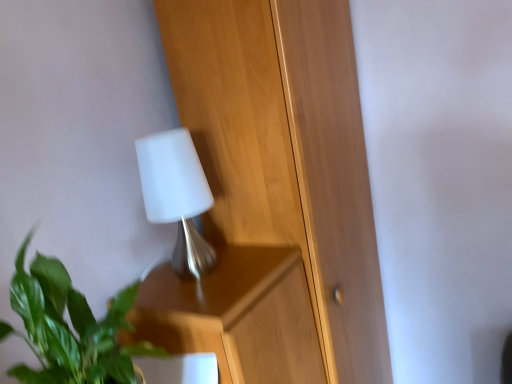
Measure the distance between green leafy plant at lower left and camera.

green leafy plant at lower left and camera are 21.06 inches apart from each other.

This screenshot has width=512, height=384. What do you see at coordinates (177, 196) in the screenshot?
I see `white matte lamp at upper center` at bounding box center [177, 196].

The width and height of the screenshot is (512, 384). I want to click on green leafy plant at lower left, so click(x=69, y=328).

From a real-world perspective, relative to green leafy plant at lower left, is wooden dresser at center vertically above or below?

wooden dresser at center is below green leafy plant at lower left.

From the image's perspective, between wooden dresser at center and green leafy plant at lower left, which one is located above?

wooden dresser at center.

Is wooden dresser at center oriented towards green leafy plant at lower left?

No, wooden dresser at center is not turned towards green leafy plant at lower left.

Which is nearer, (252, 11) or (44, 290)?

Clearly, point (252, 11) is more distant from the camera than point (44, 290).

Which is in front, point (189, 150) or point (40, 370)?

The point (40, 370) is more forward.

Is white matte lamp at upper center at the right side of green leafy plant at lower left?

Indeed, white matte lamp at upper center is positioned on the right side of green leafy plant at lower left.

Is white matte lamp at upper center turned away from green leafy plant at lower left?

No, green leafy plant at lower left is not at the back of white matte lamp at upper center.

Would you consider white matte lamp at upper center to be distant from green leafy plant at lower left?

No.

Which of these two, green leafy plant at lower left or white matte lamp at upper center, is smaller?

white matte lamp at upper center.

From the image's perspective, relative to white matte lamp at upper center, is green leafy plant at lower left above or below?

Based on their image positions, green leafy plant at lower left is located beneath white matte lamp at upper center.

Can you tell me how much green leafy plant at lower left and white matte lamp at upper center differ in facing direction?

0.000794 degrees.

How distant is green leafy plant at lower left from white matte lamp at upper center?

green leafy plant at lower left is 12.32 inches away from white matte lamp at upper center.

Based on the photo, from the image's perspective, which is below, white matte lamp at upper center or wooden dresser at center?

wooden dresser at center is shown below in the image.

Considering the sizes of objects white matte lamp at upper center and wooden dresser at center in the image provided, who is bigger, white matte lamp at upper center or wooden dresser at center?

wooden dresser at center.

Is white matte lamp at upper center oriented towards wooden dresser at center?

No, white matte lamp at upper center is not oriented towards wooden dresser at center.

Who is shorter, white matte lamp at upper center or wooden dresser at center?

white matte lamp at upper center.

Is wooden dresser at center inside the boundaries of white matte lamp at upper center, or outside?

wooden dresser at center is not enclosed by white matte lamp at upper center.

Is wooden dresser at center next to white matte lamp at upper center and touching it?

No, wooden dresser at center is not beside white matte lamp at upper center.

Is wooden dresser at center to the right of white matte lamp at upper center from the viewer's perspective?

Yes, wooden dresser at center is to the right of white matte lamp at upper center.

In the scene shown: Which of these two, wooden dresser at center or white matte lamp at upper center, stands taller?

Standing taller between the two is wooden dresser at center.

Considering the sizes of objects green leafy plant at lower left and wooden dresser at center in the image provided, who is thinner, green leafy plant at lower left or wooden dresser at center?

green leafy plant at lower left is thinner.

Is point (58, 337) behind point (225, 25)?

No, it is not.

Is green leafy plant at lower left turned away from wooden dresser at center?

That's not correct — green leafy plant at lower left is not looking away from wooden dresser at center.

Identify the location of dresser above the green leafy plant at lower left (from the image's perspective). click(x=286, y=153).

The height and width of the screenshot is (384, 512). In order to click on lamp above the green leafy plant at lower left (from a real-world perspective) in this screenshot , I will do `click(177, 196)`.

When comparing their distances from wooden dresser at center, does white matte lamp at upper center or green leafy plant at lower left seem further?

green leafy plant at lower left lies further to wooden dresser at center than the other object.

Looking at the image, which one is located further to green leafy plant at lower left, wooden dresser at center or white matte lamp at upper center?

wooden dresser at center is positioned further to the anchor green leafy plant at lower left.

Consider the image. Estimate the real-world distances between objects in this image. Which object is closer to white matte lamp at upper center, wooden dresser at center or green leafy plant at lower left?

wooden dresser at center.

When comparing their distances from green leafy plant at lower left, does white matte lamp at upper center or wooden dresser at center seem closer?

The object closer to green leafy plant at lower left is white matte lamp at upper center.

Estimate the real-world distances between objects in this image. Which object is further from wooden dresser at center, green leafy plant at lower left or white matte lamp at upper center?

Among the two, green leafy plant at lower left is located further to wooden dresser at center.

Based on their spatial positions, is green leafy plant at lower left or wooden dresser at center closer to white matte lamp at upper center?

Among the two, wooden dresser at center is located nearer to white matte lamp at upper center.

This screenshot has width=512, height=384. In order to click on lamp located between green leafy plant at lower left and wooden dresser at center in the depth direction in this screenshot , I will do `click(177, 196)`.